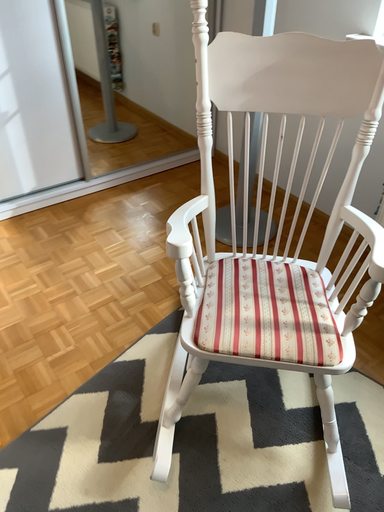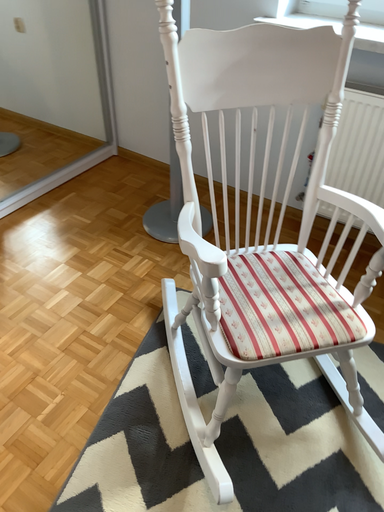
Question: How did the camera likely rotate when shooting the video?

Choices:
 (A) rotated left
 (B) rotated right

Answer: (B)